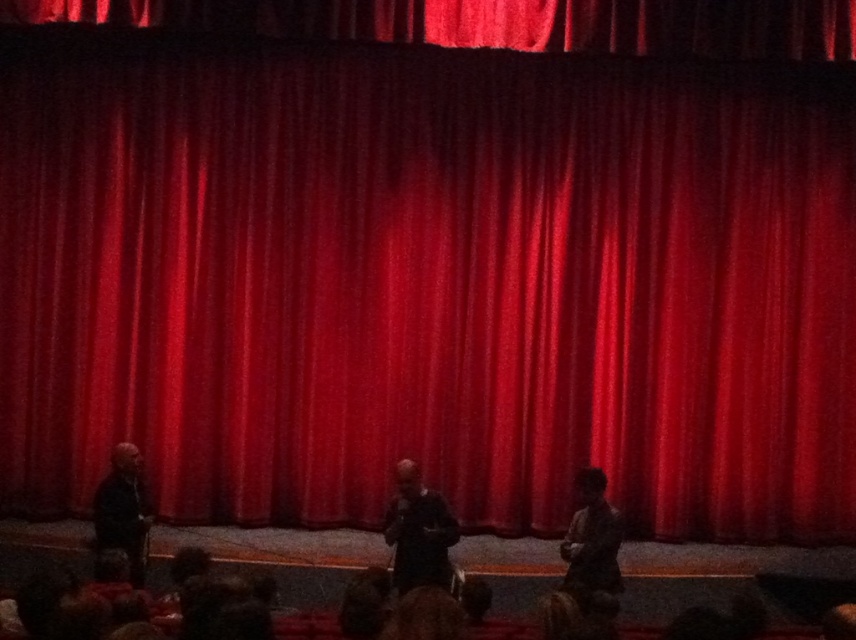
Does camouflage-patterned shirt at lower right have a greater height compared to dark gray suit at left?

No.

Is point (565, 554) farther from camera compared to point (105, 504)?

No, it is in front of (105, 504).

Where is `camouflage-patterned shirt at lower right`? This screenshot has height=640, width=856. camouflage-patterned shirt at lower right is located at coordinates (591, 540).

Based on the photo, does dark gray shirt at center appear on the left side of camouflage-patterned shirt at lower right?

Correct, you'll find dark gray shirt at center to the left of camouflage-patterned shirt at lower right.

Is dark gray shirt at center to the right of camouflage-patterned shirt at lower right from the viewer's perspective?

No, dark gray shirt at center is not to the right of camouflage-patterned shirt at lower right.

Image resolution: width=856 pixels, height=640 pixels. What do you see at coordinates (418, 531) in the screenshot?
I see `dark gray shirt at center` at bounding box center [418, 531].

This screenshot has height=640, width=856. Find the location of `dark gray shirt at center`. dark gray shirt at center is located at coordinates (418, 531).

Does dark gray shirt at center appear over dark gray suit at left?

Actually, dark gray shirt at center is below dark gray suit at left.

Is point (408, 492) behind point (141, 541)?

No.

Which is behind, point (421, 522) or point (104, 536)?

The point (421, 522) is behind.

Where is `dark gray shirt at center`? The height and width of the screenshot is (640, 856). dark gray shirt at center is located at coordinates (418, 531).